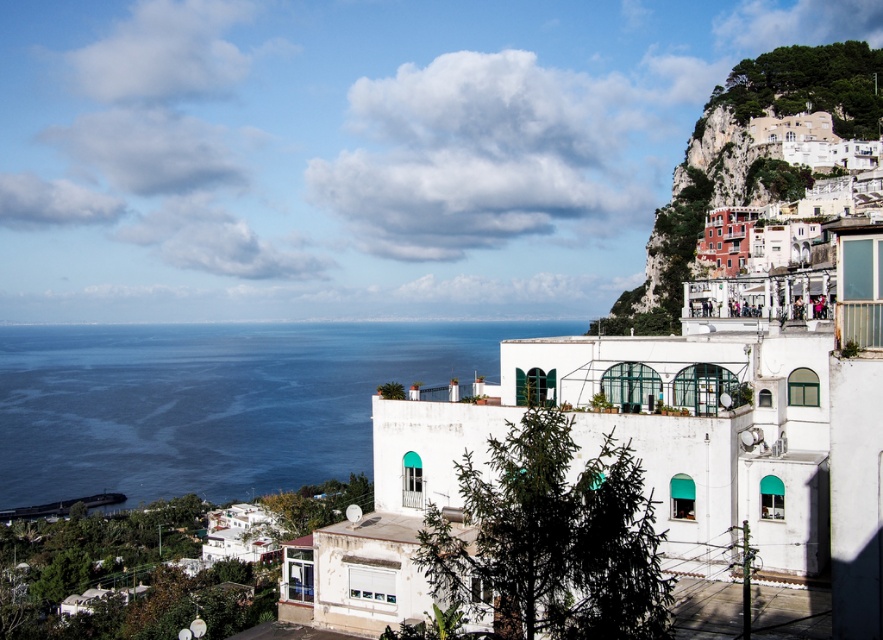
Who is more forward, (530, 321) or (682, 188)?

Point (682, 188) is in front.

Is point (258, 448) behind point (723, 186)?

That is True.

Locate an element on the screen. This screenshot has width=883, height=640. blue water at left is located at coordinates (214, 401).